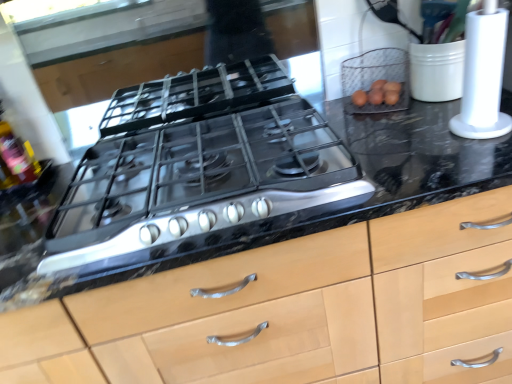
The height and width of the screenshot is (384, 512). I want to click on vacant space in front of wire mesh basket at upper right, so click(x=388, y=128).